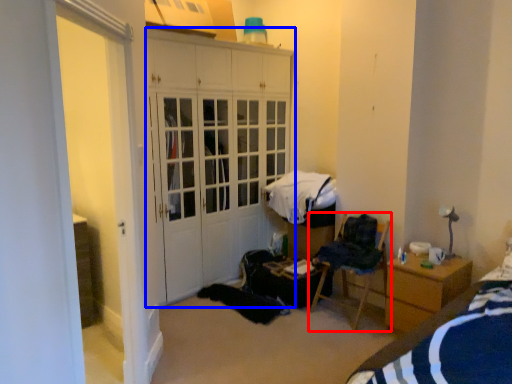
Question: Which of the following is the farthest to the observer, chair (highlighted by a red box) or cabinetry (highlighted by a blue box)?

Choices:
 (A) chair
 (B) cabinetry

Answer: (B)